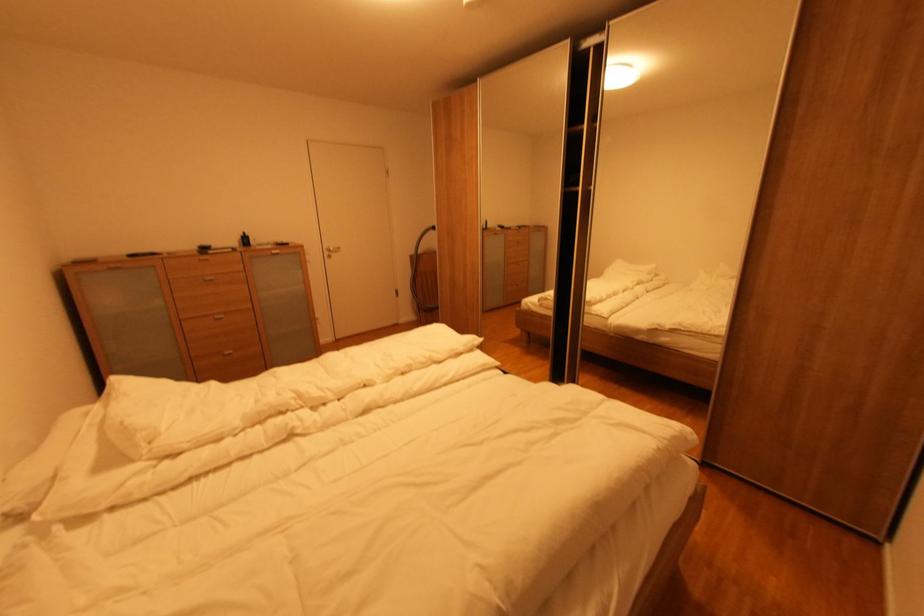
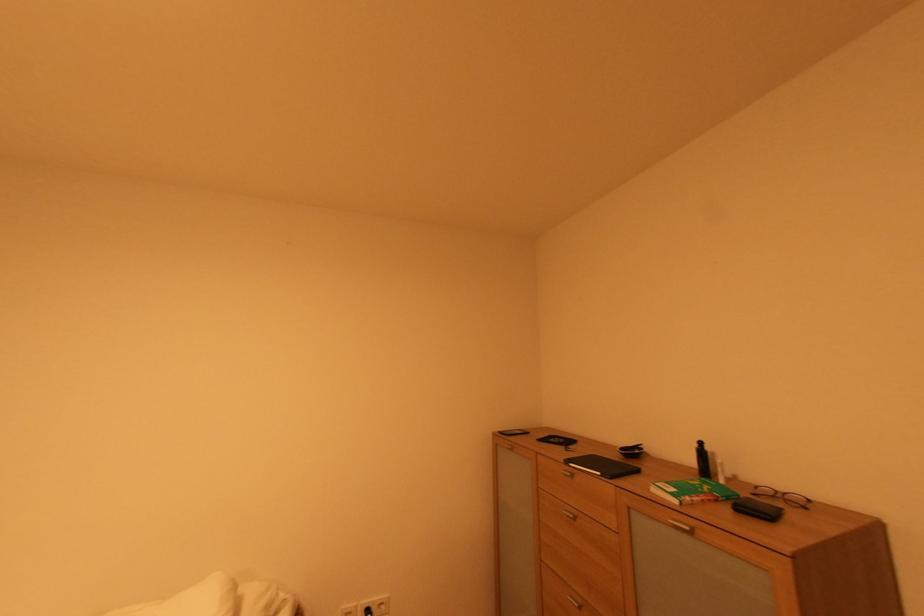
In the second image, find the point that corresponds to (275,248) in the first image.

(682, 503)